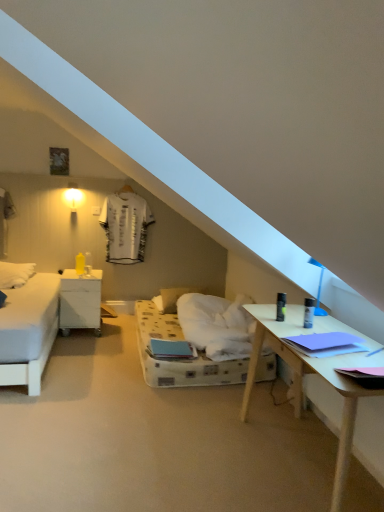
Question: Is white matte nightstand at left taller or shorter than white soft pillow at center?

Choices:
 (A) tall
 (B) short

Answer: (A)

Question: Is white matte nightstand at left in front of or behind white soft pillow at center in the image?

Choices:
 (A) behind
 (B) front

Answer: (B)

Question: From a real-world perspective, is white matte nightstand at left physically located above or below white soft pillow at center?

Choices:
 (A) below
 (B) above

Answer: (B)

Question: Would you say white soft pillow at center is inside or outside white matte nightstand at left?

Choices:
 (A) outside
 (B) inside

Answer: (A)

Question: Considering the positions of white soft pillow at center and white matte nightstand at left in the image, is white soft pillow at center wider or thinner than white matte nightstand at left?

Choices:
 (A) wide
 (B) thin

Answer: (B)

Question: Considering the positions of white soft pillow at center and white matte nightstand at left in the image, is white soft pillow at center bigger or smaller than white matte nightstand at left?

Choices:
 (A) small
 (B) big

Answer: (A)

Question: Considering their positions, is white soft pillow at center located in front of or behind white matte nightstand at left?

Choices:
 (A) front
 (B) behind

Answer: (B)